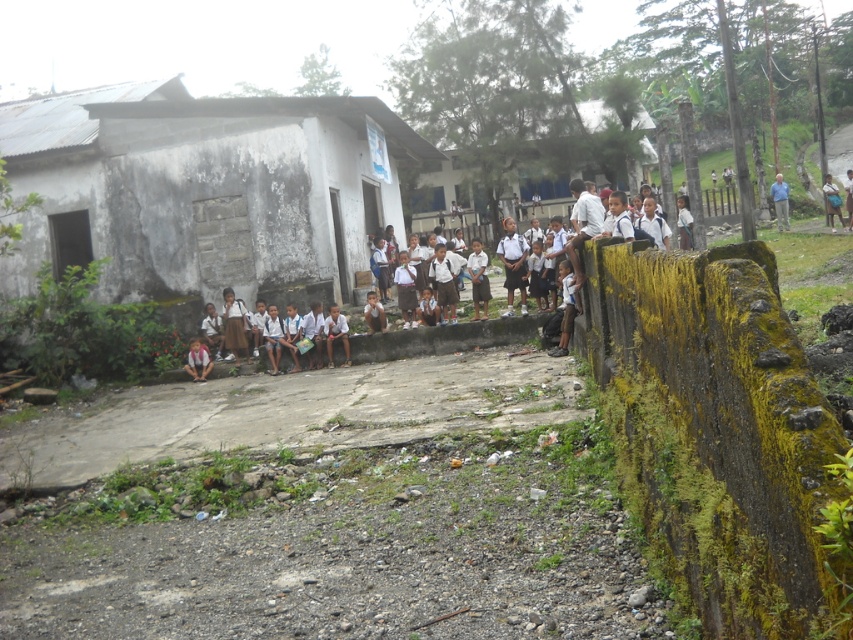
Question: Which point is farther to the camera?

Choices:
 (A) (453, 168)
 (B) (93, 220)
 (C) (836, 192)

Answer: (A)

Question: Estimate the real-world distances between objects in this image. Which object is farther from the light brown wooden chair at upper right?

Choices:
 (A) white matte hut at upper center
 (B) white stone building at left

Answer: (B)

Question: Does white stone building at left have a greater width compared to light brown wooden chair at upper right?

Choices:
 (A) yes
 (B) no

Answer: (A)

Question: Where is white stone building at left located in relation to light brown wooden chair at upper right in the image?

Choices:
 (A) above
 (B) below

Answer: (A)

Question: Is the position of white matte hut at upper center more distant than that of light brown wooden chair at upper right?

Choices:
 (A) yes
 (B) no

Answer: (A)

Question: Which object is the closest to the light brown wooden chair at upper right?

Choices:
 (A) white stone building at left
 (B) white matte hut at upper center

Answer: (B)